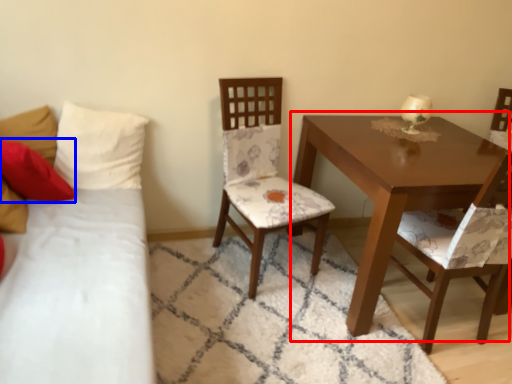
Question: Which of the following is the closest to the observer, table (highlighted by a red box) or pillow (highlighted by a blue box)?

Choices:
 (A) table
 (B) pillow

Answer: (A)